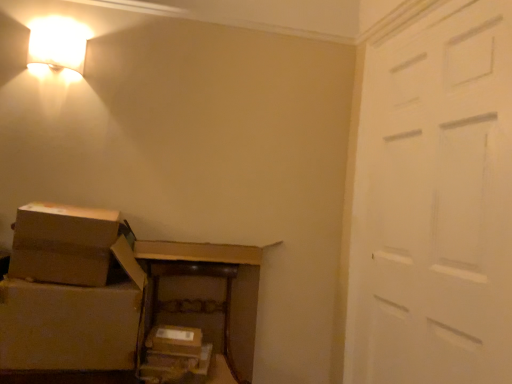
Question: Is brown cardboard box at lower left, which ranks as the 2th box in top-to-bottom order, positioned far away from brown cardboard box at lower center, the 2th storage box when ordered from bottom to top?

Choices:
 (A) no
 (B) yes

Answer: (A)

Question: From a real-world perspective, is brown cardboard box at lower left, arranged as the first box when ordered from the bottom, below brown cardboard box at lower center, which is the 1th storage box from top to bottom?

Choices:
 (A) no
 (B) yes

Answer: (A)

Question: Is brown cardboard box at lower left, arranged as the first box when ordered from the bottom, at the right side of brown cardboard box at lower center, the 2th storage box when ordered from bottom to top?

Choices:
 (A) no
 (B) yes

Answer: (A)

Question: Can you confirm if brown cardboard box at lower left, which ranks as the 2th box in top-to-bottom order, is bigger than brown cardboard box at lower center, the 2th storage box when ordered from bottom to top?

Choices:
 (A) yes
 (B) no

Answer: (A)

Question: Does brown cardboard box at lower left, arranged as the first box when ordered from the bottom, have a smaller size compared to brown cardboard box at lower center, the 2th storage box when ordered from bottom to top?

Choices:
 (A) yes
 (B) no

Answer: (B)

Question: Based on their positions, is white matte door at right located to the left or right of matte white wall sconce at upper left?

Choices:
 (A) right
 (B) left

Answer: (A)

Question: From a real-world perspective, relative to matte white wall sconce at upper left, is white matte door at right vertically above or below?

Choices:
 (A) below
 (B) above

Answer: (A)

Question: From the image's perspective, relative to matte white wall sconce at upper left, is white matte door at right above or below?

Choices:
 (A) below
 (B) above

Answer: (A)

Question: Would you say white matte door at right is inside or outside matte white wall sconce at upper left?

Choices:
 (A) outside
 (B) inside

Answer: (A)

Question: Would you say brown cardboard box at lower center, marked as the 1th storage box in a bottom-to-top arrangement, is inside or outside matte white wall sconce at upper left?

Choices:
 (A) inside
 (B) outside

Answer: (B)

Question: From the image's perspective, relative to matte white wall sconce at upper left, is brown cardboard box at lower center, marked as the 1th storage box in a bottom-to-top arrangement, above or below?

Choices:
 (A) below
 (B) above

Answer: (A)

Question: Looking at the image, does brown cardboard box at lower center, marked as the 1th storage box in a bottom-to-top arrangement, seem bigger or smaller compared to matte white wall sconce at upper left?

Choices:
 (A) big
 (B) small

Answer: (A)

Question: Considering the positions of point (148, 360) and point (37, 52), is point (148, 360) closer or farther from the camera than point (37, 52)?

Choices:
 (A) closer
 (B) farther

Answer: (A)

Question: Is white matte door at right taller or shorter than brown cardboard box at lower left, marked as the second box in a bottom-to-top arrangement?

Choices:
 (A) short
 (B) tall

Answer: (B)

Question: Is white matte door at right wider or thinner than brown cardboard box at lower left, marked as the second box in a bottom-to-top arrangement?

Choices:
 (A) wide
 (B) thin

Answer: (B)